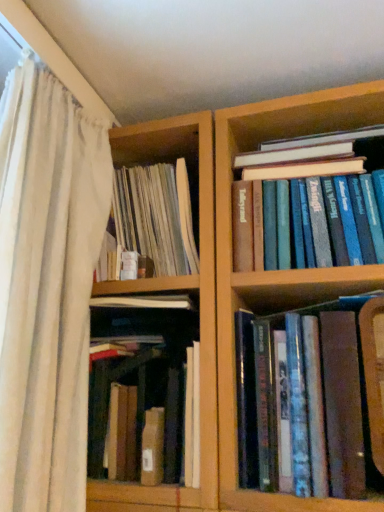
Question: Choose the correct answer: Is brown leather book at lower right, the 2th book viewed from the left, inside white sheer curtain at left or outside it?

Choices:
 (A) outside
 (B) inside

Answer: (A)

Question: Is brown leather book at lower right, the 2th book viewed from the left, to the left or to the right of white sheer curtain at left in the image?

Choices:
 (A) right
 (B) left

Answer: (A)

Question: Considering the real-world distances, which object is closest to the brown leather book at lower right, the 2th book viewed from the left?

Choices:
 (A) blue hardcover books at upper right, which appears as the 3th book when viewed from the left
 (B) white sheer curtain at left
 (C) brown cardboard box at center, the 1th book from the left

Answer: (C)

Question: Which object is the closest to the white sheer curtain at left?

Choices:
 (A) blue hardcover books at upper right, which appears as the 3th book when viewed from the left
 (B) brown cardboard box at center, the 1th book from the left
 (C) brown leather book at lower right, the 2th book in the right-to-left sequence

Answer: (B)